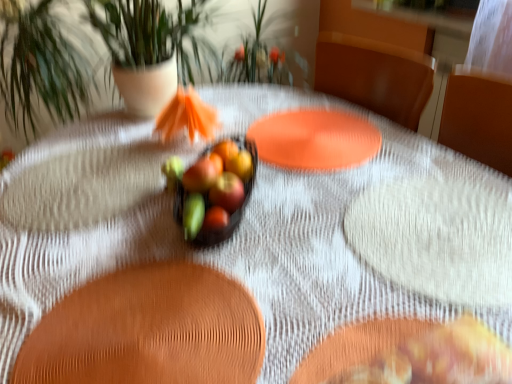
You are a GUI agent. You are given a task and a screenshot of the screen. Output one action in this format:
    pyautogui.click(x=<x>, y=<y>)
    Task: Click on the vacant space that is to the left of glossy apple at center, arranged as the first apple when viewed from the back
    
    Given the screenshot: What is the action you would take?
    pyautogui.click(x=146, y=194)